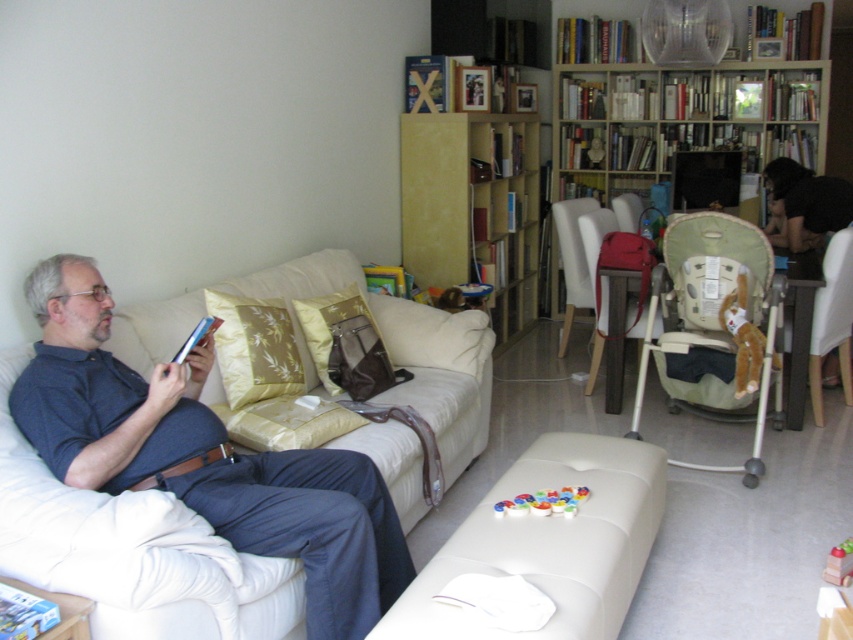
Which is below, beige fabric baby carriage at right or multicolored plastic rings at center?

multicolored plastic rings at center

Can you confirm if beige fabric baby carriage at right is bigger than multicolored plastic rings at center?

Correct, beige fabric baby carriage at right is larger in size than multicolored plastic rings at center.

Image resolution: width=853 pixels, height=640 pixels. In order to click on beige fabric baby carriage at right in this screenshot , I will do [714, 307].

Does blue cotton shirt at left appear under white plastic chair at right?

Yes, blue cotton shirt at left is below white plastic chair at right.

Is blue cotton shirt at left closer to camera compared to white plastic chair at right?

That is True.

Is point (310, 579) farther from viewer compared to point (828, 337)?

No, (310, 579) is closer to viewer.

The width and height of the screenshot is (853, 640). In order to click on blue cotton shirt at left in this screenshot , I will do pos(103,388).

Which of these two, beige fabric couch at left or matte brown chair at center, stands shorter?

matte brown chair at center

Between point (173, 328) and point (560, 344), which one is positioned in front?

Point (173, 328)

The width and height of the screenshot is (853, 640). Describe the element at coordinates (399, 349) in the screenshot. I see `beige fabric couch at left` at that location.

Where is `beige fabric couch at left`? beige fabric couch at left is located at coordinates (399, 349).